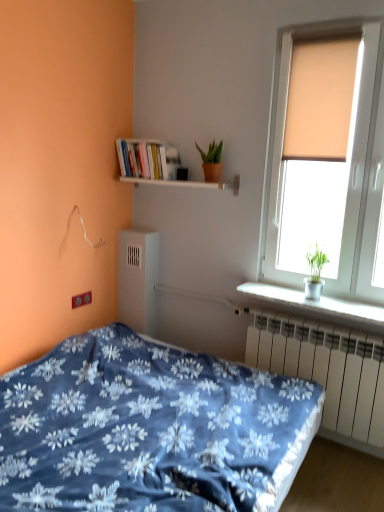
Question: From the image's perspective, is matte orange pot at upper center above white wooden shelf at upper center, the 1th window sill viewed from the left?

Choices:
 (A) yes
 (B) no

Answer: (A)

Question: Is the depth of matte orange pot at upper center less than that of white wooden shelf at upper center, the 1th window sill viewed from the left?

Choices:
 (A) yes
 (B) no

Answer: (B)

Question: Is matte orange pot at upper center surrounding white wooden shelf at upper center, marked as the second window sill in a right-to-left arrangement?

Choices:
 (A) yes
 (B) no

Answer: (B)

Question: Is matte orange pot at upper center facing away from white wooden shelf at upper center, positioned as the first window sill in top-to-bottom order?

Choices:
 (A) no
 (B) yes

Answer: (A)

Question: Are matte orange pot at upper center and white wooden shelf at upper center, positioned as the first window sill in top-to-bottom order, far apart?

Choices:
 (A) yes
 (B) no

Answer: (B)

Question: Can you confirm if matte orange pot at upper center is bigger than white wooden shelf at upper center, marked as the second window sill in a right-to-left arrangement?

Choices:
 (A) no
 (B) yes

Answer: (A)

Question: Considering the relative sizes of matte orange pot at upper center and blue floral fabric bed at lower left in the image provided, is matte orange pot at upper center shorter than blue floral fabric bed at lower left?

Choices:
 (A) yes
 (B) no

Answer: (A)

Question: Is matte orange pot at upper center smaller than blue floral fabric bed at lower left?

Choices:
 (A) no
 (B) yes

Answer: (B)

Question: Is matte orange pot at upper center facing towards blue floral fabric bed at lower left?

Choices:
 (A) no
 (B) yes

Answer: (A)

Question: Is matte orange pot at upper center placed right next to blue floral fabric bed at lower left?

Choices:
 (A) no
 (B) yes

Answer: (A)

Question: Does matte orange pot at upper center have a greater height compared to blue floral fabric bed at lower left?

Choices:
 (A) yes
 (B) no

Answer: (B)

Question: Can you confirm if matte orange pot at upper center is positioned to the left of blue floral fabric bed at lower left?

Choices:
 (A) no
 (B) yes

Answer: (A)

Question: From the image's perspective, is matte beige window at upper right below hardcover books at upper left?

Choices:
 (A) no
 (B) yes

Answer: (B)